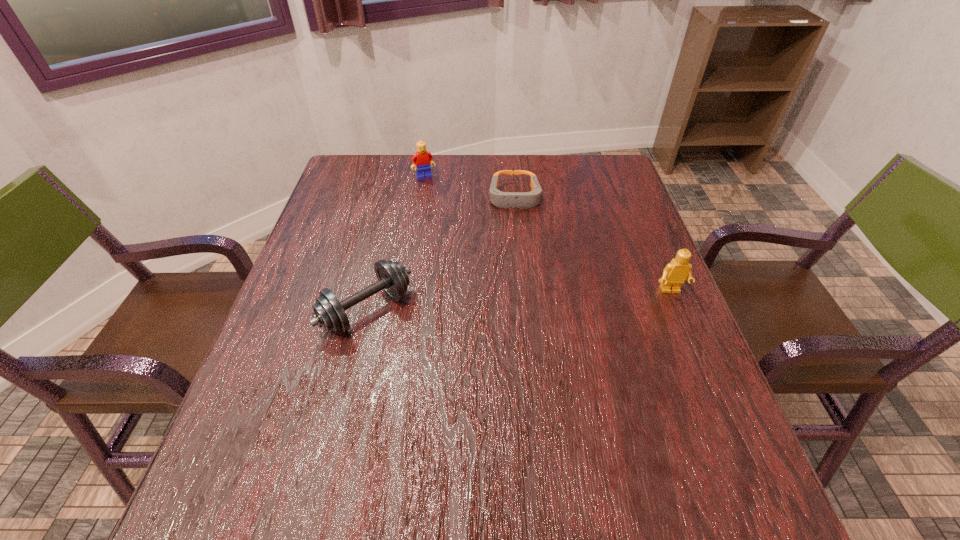
The height and width of the screenshot is (540, 960). I want to click on dumbbell, so click(329, 313).

This screenshot has width=960, height=540. I want to click on the rightmost object, so click(678, 270).

Find the location of a particular element. The width and height of the screenshot is (960, 540). the right Lego is located at coordinates (678, 270).

Identify the location of the shortest object. This screenshot has width=960, height=540. (522, 200).

Image resolution: width=960 pixels, height=540 pixels. Identify the location of the third object from left to right. (522, 200).

The width and height of the screenshot is (960, 540). I want to click on the farthest object, so [x=422, y=158].

You are a GUI agent. You are given a task and a screenshot of the screen. Output one action in this format:
    pyautogui.click(x=<x>, y=<y>)
    Task: Click on the farther Lego
    The height and width of the screenshot is (540, 960).
    Given the screenshot: What is the action you would take?
    pyautogui.click(x=422, y=158)

At what (x,y) coordinates should I click in order to perform the action: click on vacant space located on the front of the third tallest object. Please return your answer as a coordinate pair (x, y). This screenshot has height=540, width=960. Looking at the image, I should click on (332, 456).

You are a GUI agent. You are given a task and a screenshot of the screen. Output one action in this format:
    pyautogui.click(x=<x>, y=<y>)
    Task: Click on the vacant region located 0.100m on the face of the right Lego
    Image resolution: width=960 pixels, height=540 pixels.
    Given the screenshot: What is the action you would take?
    pyautogui.click(x=687, y=332)

Image resolution: width=960 pixels, height=540 pixels. In order to click on free region located on the front and back of the second object from right to left in this screenshot , I will do `click(526, 325)`.